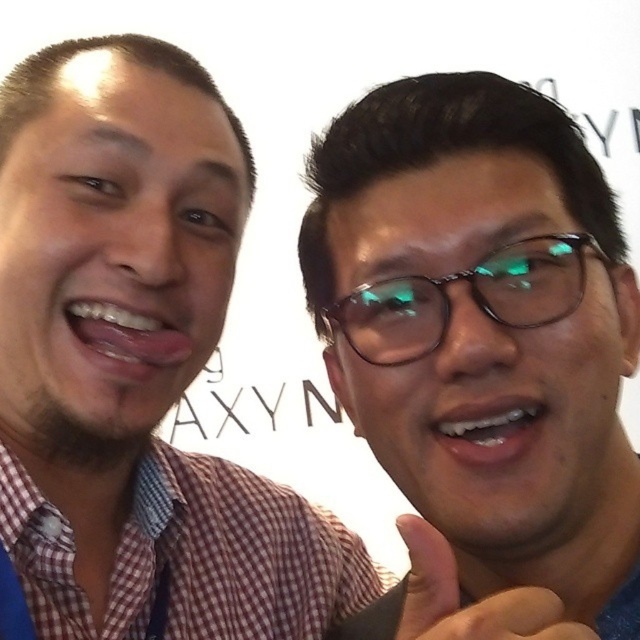
Does checkered shirt at left appear on the right side of matte black glasses at upper right?

In fact, checkered shirt at left is to the left of matte black glasses at upper right.

Which is below, checkered shirt at left or matte black glasses at upper right?

checkered shirt at left is lower down.

Who is more distant from viewer, (141, 442) or (461, 524)?

Positioned behind is point (141, 442).

Where is `checkered shirt at left`? The image size is (640, 640). checkered shirt at left is located at coordinates (134, 365).

Is red checkered shirt at left smaller than green reflective glasses at center?

Incorrect, red checkered shirt at left is not smaller in size than green reflective glasses at center.

Is red checkered shirt at left closer to the viewer compared to green reflective glasses at center?

That is False.

Identify the location of red checkered shirt at left. (193, 556).

Can you confirm if checkered shirt at left is positioned to the right of green reflective glasses at center?

No, checkered shirt at left is not to the right of green reflective glasses at center.

You are a GUI agent. You are given a task and a screenshot of the screen. Output one action in this format:
    pyautogui.click(x=<x>, y=<y>)
    Task: Click on the checkered shirt at left
    This screenshot has width=640, height=640.
    Given the screenshot: What is the action you would take?
    pyautogui.click(x=134, y=365)

Who is more forward, (115, 320) or (540, 291)?

Positioned in front is point (540, 291).

Identify the location of checkered shirt at left. This screenshot has height=640, width=640. (134, 365).